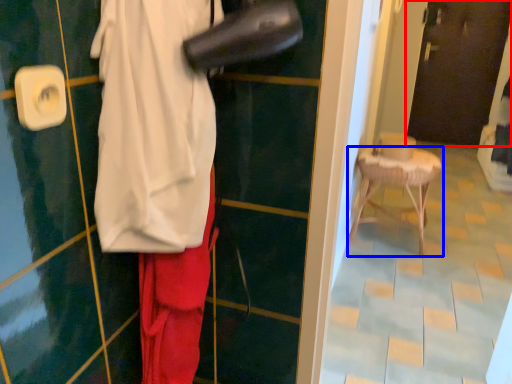
Question: Which object appears closest to the camera in this image, door (highlighted by a red box) or furniture (highlighted by a blue box)?

Choices:
 (A) door
 (B) furniture

Answer: (B)